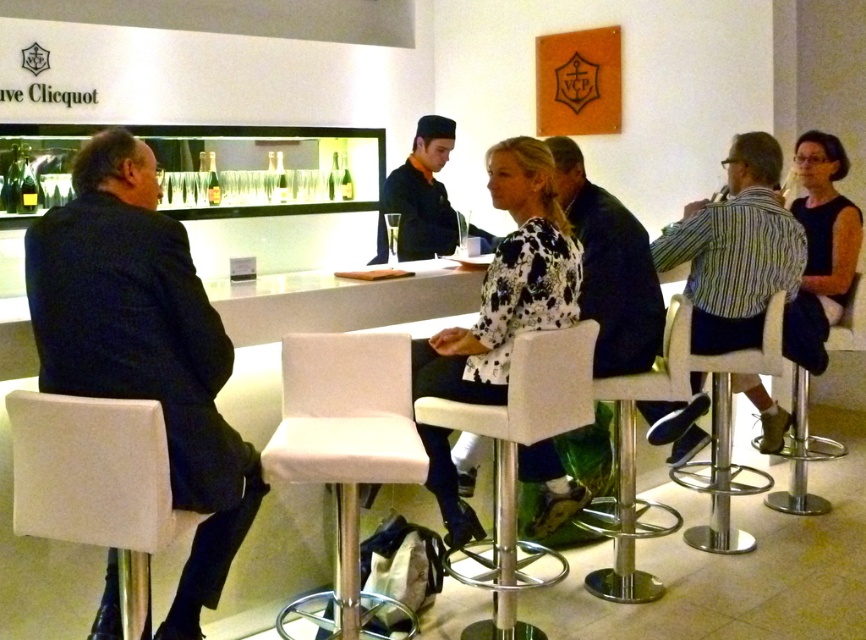
Who is shorter, dark blue suit at left or white fabric bar stool at center?

white fabric bar stool at center

Based on the photo, is dark blue suit at left shorter than white fabric bar stool at center?

Incorrect, dark blue suit at left's height does not fall short of white fabric bar stool at center's.

You are a GUI agent. You are given a task and a screenshot of the screen. Output one action in this format:
    pyautogui.click(x=<x>, y=<y>)
    Task: Click on the dark blue suit at left
    The width and height of the screenshot is (866, 640).
    Given the screenshot: What is the action you would take?
    pyautogui.click(x=144, y=346)

How much distance is there between white fabric bar stool at lower left and clear glass bottle at center?

They are 3.32 meters apart.

The image size is (866, 640). I want to click on white fabric bar stool at lower left, so click(95, 483).

Does point (111, 518) lie in front of point (346, 195)?

Yes, it is.

The image size is (866, 640). In order to click on white fabric bar stool at lower left in this screenshot , I will do `click(95, 483)`.

Does white fabric bar stool at lower left have a greater height compared to white fabric bar stool at center?

Incorrect, white fabric bar stool at lower left's height is not larger of white fabric bar stool at center's.

You are a GUI agent. You are given a task and a screenshot of the screen. Output one action in this format:
    pyautogui.click(x=<x>, y=<y>)
    Task: Click on the white fabric bar stool at lower left
    The image size is (866, 640).
    Given the screenshot: What is the action you would take?
    (95, 483)